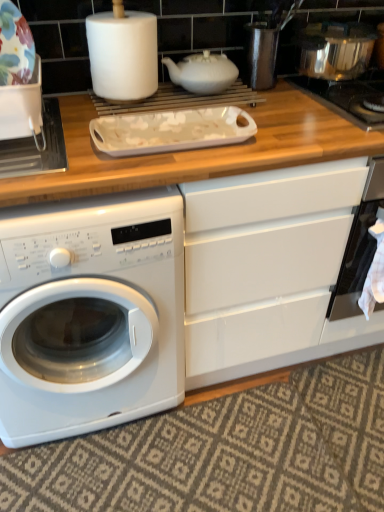
Find the location of `vacant space that is to the left of white matte paper towel at upper center`. vacant space that is to the left of white matte paper towel at upper center is located at coordinates (71, 97).